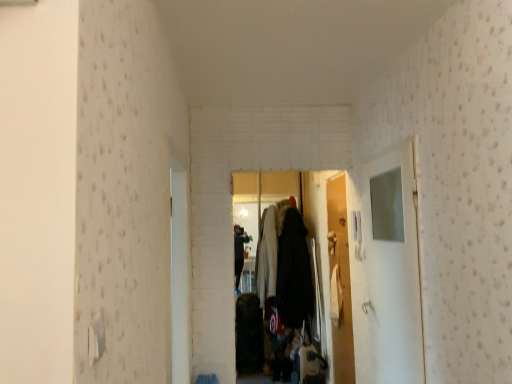
What do you see at coordinates (340, 281) in the screenshot? The image size is (512, 384). I see `white glossy door at center, the second door in the front-to-back sequence` at bounding box center [340, 281].

The image size is (512, 384). What are the coordinates of `white glossy door at center, the first door in the front-to-back sequence` in the screenshot? It's located at (179, 273).

Find the location of a particular element. Image resolution: width=512 pixels, height=384 pixels. transparent glass door at right is located at coordinates (386, 269).

Are white glossy door at center, the second door in the right-to-left sequence, and transparent glass door at right beside each other?

No, white glossy door at center, the second door in the right-to-left sequence, is not touching transparent glass door at right.

Is white glossy door at center, the second door in the right-to-left sequence, further to camera compared to transparent glass door at right?

No, it is not.

Is white glossy door at center, the first door in the front-to-back sequence, positioned beyond the bounds of transparent glass door at right?

That's correct, white glossy door at center, the first door in the front-to-back sequence, is outside of transparent glass door at right.

From the image's perspective, is white glossy door at center, the second door in the right-to-left sequence, below transparent glass door at right?

Incorrect, from the image's perspective, white glossy door at center, the second door in the right-to-left sequence, is higher than transparent glass door at right.

Based on their sizes in the image, would you say transparent glass door at right is bigger or smaller than white glossy door at center, acting as the second door starting from the left?

Clearly, transparent glass door at right is larger in size than white glossy door at center, acting as the second door starting from the left.

From a real-world perspective, which is physically below, transparent glass door at right or white glossy door at center, the second door in the front-to-back sequence?

white glossy door at center, the second door in the front-to-back sequence, is physically lower.

Find the location of a particular element. The height and width of the screenshot is (384, 512). door below the transparent glass door at right (from a real-world perspective) is located at coordinates (340, 281).

Would you consider transparent glass door at right to be distant from white glossy door at center, the 1th door when ordered from back to front?

No, there isn't a large distance between transparent glass door at right and white glossy door at center, the 1th door when ordered from back to front.

Do you think transparent glass door at right is within white glossy door at center, which appears as the first door when viewed from the left, or outside of it?

transparent glass door at right lies outside white glossy door at center, which appears as the first door when viewed from the left.

From the image's perspective, between transparent glass door at right and white glossy door at center, the second door in the right-to-left sequence, who is located below?

From the image's view, transparent glass door at right is below.

Considering the relative positions of transparent glass door at right and white glossy door at center, which appears as the first door when viewed from the left, in the image provided, is transparent glass door at right to the left or to the right of white glossy door at center, which appears as the first door when viewed from the left,?

In the image, transparent glass door at right appears on the right side of white glossy door at center, which appears as the first door when viewed from the left.

Is white glossy door at center, the second door in the right-to-left sequence, aimed at white glossy door at center, the second door in the front-to-back sequence?

No, white glossy door at center, the second door in the right-to-left sequence, is not aimed at white glossy door at center, the second door in the front-to-back sequence.

Between white glossy door at center, which appears as the first door when viewed from the left, and white glossy door at center, acting as the second door starting from the left, which one has more height?

With more height is white glossy door at center, acting as the second door starting from the left.

From a real-world perspective, who is located higher, white glossy door at center, which appears as the first door when viewed from the left, or white glossy door at center, which ranks as the 1th door in right-to-left order?

white glossy door at center, which appears as the first door when viewed from the left.

Considering the relative sizes of white glossy door at center, the first door in the front-to-back sequence, and white glossy door at center, which ranks as the 1th door in right-to-left order, in the image provided, is white glossy door at center, the first door in the front-to-back sequence, thinner than white glossy door at center, which ranks as the 1th door in right-to-left order,?

Incorrect, the width of white glossy door at center, the first door in the front-to-back sequence, is not less than that of white glossy door at center, which ranks as the 1th door in right-to-left order.

Is point (349, 288) less distant than point (184, 332)?

That is False.

Is the surface of white glossy door at center, acting as the second door starting from the left, in direct contact with white glossy door at center, the second door in the right-to-left sequence?

They are not placed beside each other.

Looking at this image, is white glossy door at center, which ranks as the 1th door in right-to-left order, facing away from white glossy door at center, the second door in the right-to-left sequence?

No, white glossy door at center, which ranks as the 1th door in right-to-left order,'s orientation is not away from white glossy door at center, the second door in the right-to-left sequence.

Between white glossy door at center, the second door in the front-to-back sequence, and transparent glass door at right, which one has larger width?

transparent glass door at right.

From a real-world perspective, is white glossy door at center, which ranks as the 1th door in right-to-left order, positioned above or below transparent glass door at right?

white glossy door at center, which ranks as the 1th door in right-to-left order, is situated lower than transparent glass door at right in the real world.

From the image's perspective, which is above, white glossy door at center, acting as the second door starting from the left, or transparent glass door at right?

transparent glass door at right appears higher in the image.

Does white glossy door at center, the 1th door when ordered from back to front, come in front of transparent glass door at right?

That is False.

The height and width of the screenshot is (384, 512). Find the location of `glass door below the white glossy door at center, the 2th door when ordered from back to front (from the image's perspective)`. glass door below the white glossy door at center, the 2th door when ordered from back to front (from the image's perspective) is located at coordinates (386, 269).

Identify the location of glass door above the white glossy door at center, the 1th door when ordered from back to front (from the image's perspective). (386, 269).

Estimate the real-world distances between objects in this image. Which object is further from white glossy door at center, which ranks as the 1th door in right-to-left order, white glossy door at center, the second door in the right-to-left sequence, or transparent glass door at right?

Among the two, white glossy door at center, the second door in the right-to-left sequence, is located further to white glossy door at center, which ranks as the 1th door in right-to-left order.

From the image, which object appears to be farther from transparent glass door at right, white glossy door at center, the 1th door when ordered from back to front, or white glossy door at center, the first door in the front-to-back sequence?

white glossy door at center, the first door in the front-to-back sequence, lies further to transparent glass door at right than the other object.

Considering their positions, is transparent glass door at right positioned closer to white glossy door at center, acting as the second door starting from the left, than white glossy door at center, the 2th door when ordered from back to front?

transparent glass door at right lies closer to white glossy door at center, acting as the second door starting from the left, than the other object.

Based on their spatial positions, is white glossy door at center, the 2th door when ordered from back to front, or white glossy door at center, the second door in the front-to-back sequence, further from transparent glass door at right?

The object further to transparent glass door at right is white glossy door at center, the 2th door when ordered from back to front.

Which object lies nearer to the anchor point white glossy door at center, which appears as the first door when viewed from the left, white glossy door at center, the second door in the front-to-back sequence, or transparent glass door at right?

The object closer to white glossy door at center, which appears as the first door when viewed from the left, is transparent glass door at right.

Which object lies further to the anchor point white glossy door at center, the 2th door when ordered from back to front, transparent glass door at right or white glossy door at center, the second door in the front-to-back sequence?

Among the two, white glossy door at center, the second door in the front-to-back sequence, is located further to white glossy door at center, the 2th door when ordered from back to front.

The width and height of the screenshot is (512, 384). Find the location of `glass door located between white glossy door at center, which appears as the first door when viewed from the left, and white glossy door at center, the 1th door when ordered from back to front, in the depth direction`. glass door located between white glossy door at center, which appears as the first door when viewed from the left, and white glossy door at center, the 1th door when ordered from back to front, in the depth direction is located at coordinates (386, 269).